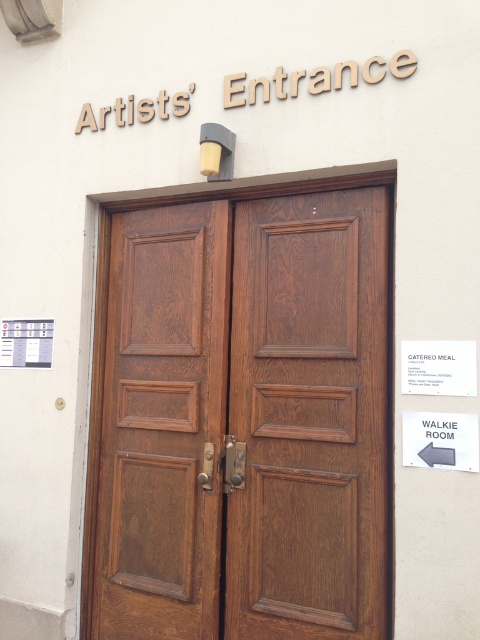
You are an artist arriving at the building and need to enter through the Artists Entrance. You have a large canvas that is 1.5 meters wide. Can you fit your canvas through the brown wood door at center without damaging it? Consider the size of the white paperboard at upper left as a reference.

The brown wood door at center is bigger than the white paperboard at upper left. Since the canvas is 1.5 meters wide, and the door is larger than the paperboard, it should be wide enough to fit the canvas through without damage.

From the picture: You are an artist arriving at the venue and need to hang a 1.2 meter wide canvas. The wooden door at center and the white paperboard at upper left are both potential spots. Which one has enough space for the canvas?

The wooden door at center has a greater width than the white paperboard at upper left. Therefore, the wooden door at center can accommodate the 1.2 meter wide canvas, while the white paperboard at upper left cannot.

You are standing in front of the building and want to enter through the brown wood door at center. Based on its position, where should you look to find the door?

The brown wood door at center is located at the coordinates point [240,416], so you should look slightly to the right of the center point of the building exterior to find it.